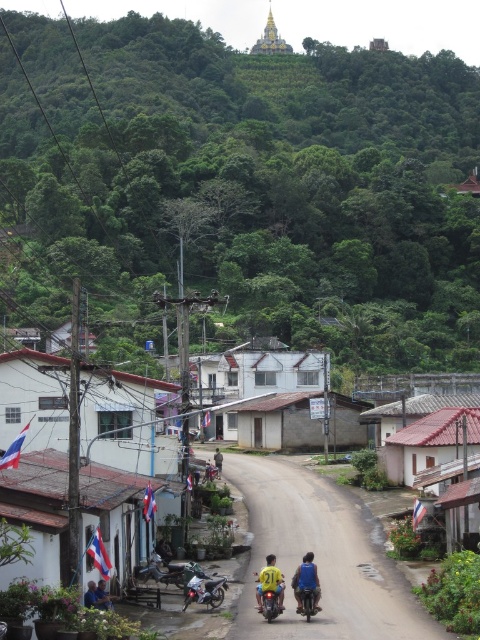
Is dark blue shirt at center shorter than yellow shirt at center?

Correct, dark blue shirt at center is not as tall as yellow shirt at center.

Between point (163, 563) and point (214, 465), which one is positioned in front?

Point (163, 563)

In order to click on dark blue shirt at center in this screenshot , I will do `click(164, 550)`.

Can you confirm if yellow fabric shirt at center is positioned to the left of silver metallic motorcycle at center?

No, yellow fabric shirt at center is not to the left of silver metallic motorcycle at center.

Locate an element on the screen. The height and width of the screenshot is (640, 480). yellow fabric shirt at center is located at coordinates (307, 588).

Does point (304, 556) lie in front of point (202, 593)?

No, it is behind (202, 593).

The height and width of the screenshot is (640, 480). I want to click on yellow fabric shirt at center, so click(307, 588).

How far apart are metallic silver motorcycle at center and dark blue shirt at center?

14.10 meters

Between point (312, 596) and point (160, 547), which one is positioned in front?

Positioned in front is point (312, 596).

The image size is (480, 640). Identify the location of metallic silver motorcycle at center. (307, 600).

Image resolution: width=480 pixels, height=640 pixels. I want to click on metallic silver motorcycle at center, so click(307, 600).